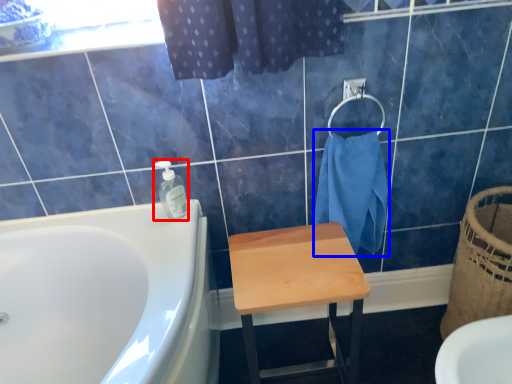
Question: Which of the following is the farthest to the observer, soap dispenser (highlighted by a red box) or bath towel (highlighted by a blue box)?

Choices:
 (A) soap dispenser
 (B) bath towel

Answer: (A)